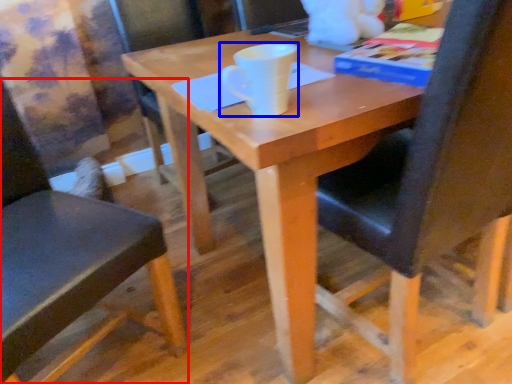
Question: Which object appears closest to the camera in this image, chair (highlighted by a red box) or coffee cup (highlighted by a blue box)?

Choices:
 (A) chair
 (B) coffee cup

Answer: (A)